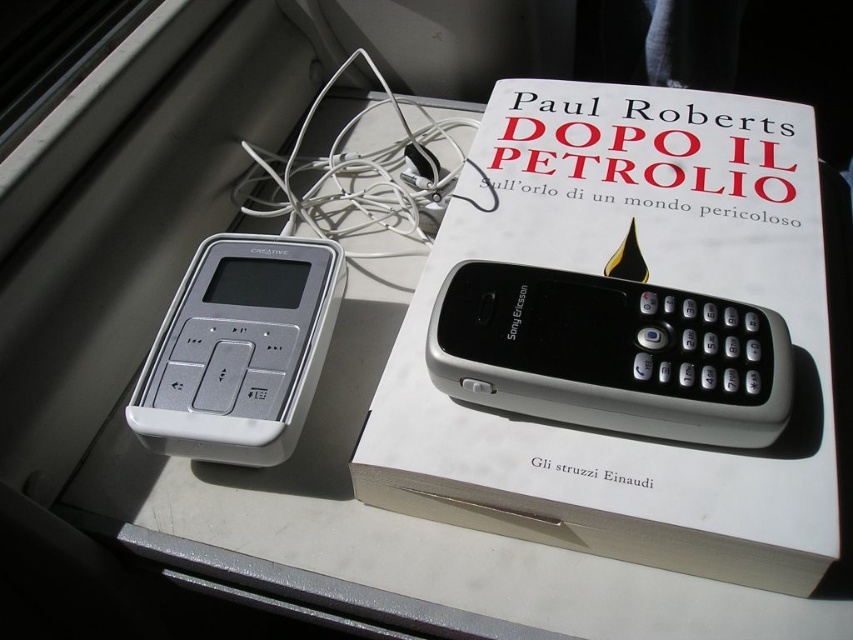
You are organizing items on a windowsill and need to know which item is taller between the white matte book at upper center and the white plastic ipod at upper left. Can you tell me which one is taller?

The white matte book at upper center is taller than the white plastic ipod at upper left according to the description.

You are a delivery robot with a 3.5 inch wide package. You need to place the package between the white matte book at upper center and the black plastic sony ericsson phone at center. Can you fit the package in that space?

The white matte book at upper center is 4.05 inches away from the black plastic sony ericsson phone at center. Since the package is 3.5 inches wide, it can fit in the space between them as the distance is greater than the package width.